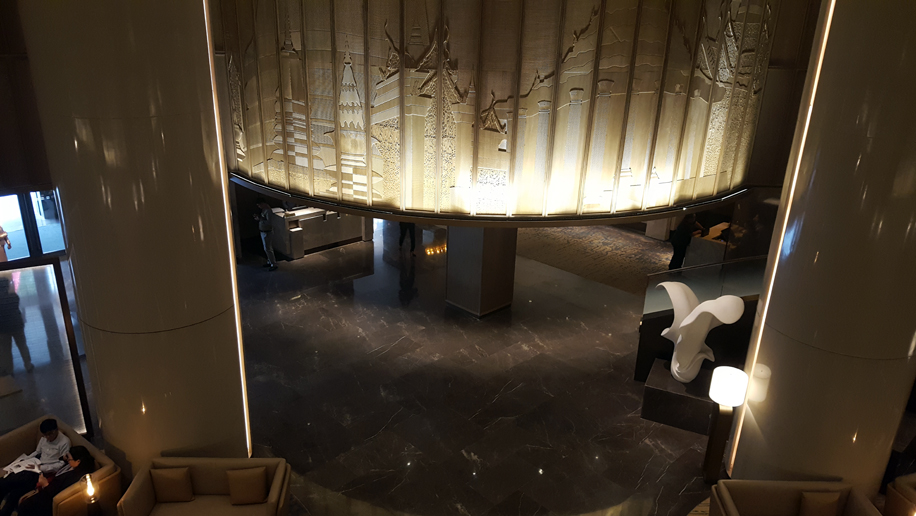
You are a GUI agent. You are given a task and a screenshot of the screen. Output one action in this format:
    pyautogui.click(x=<x>, y=<y>)
    Task: Click on the cushion
    This screenshot has width=916, height=516.
    Given the screenshot: What is the action you would take?
    pyautogui.click(x=180, y=495), pyautogui.click(x=243, y=498), pyautogui.click(x=829, y=509)